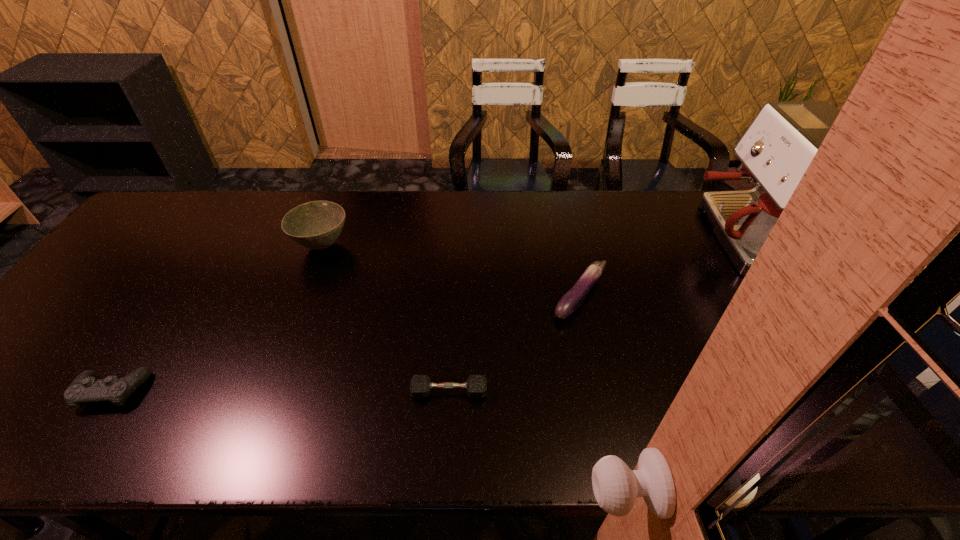
At what (x,y) coordinates should I click in order to perform the action: click on vacant area that lies between the third object from right to left and the second object from right to left. Please return your answer as a coordinate pair (x, y). Image resolution: width=960 pixels, height=540 pixels. Looking at the image, I should click on (515, 345).

The height and width of the screenshot is (540, 960). Find the location of `free space between the tallest object and the shortest object`. free space between the tallest object and the shortest object is located at coordinates (598, 314).

Where is `empty space that is in between the tallest object and the bowl`? The height and width of the screenshot is (540, 960). empty space that is in between the tallest object and the bowl is located at coordinates (535, 241).

This screenshot has width=960, height=540. What are the coordinates of `vacant point located between the leftmost object and the third object from right to left` in the screenshot? It's located at (280, 392).

Find the location of a particular element. Image resolution: width=960 pixels, height=540 pixels. vacant point located between the eggplant and the bowl is located at coordinates (451, 271).

Find the location of a particular element. This screenshot has height=540, width=960. vacant area that lies between the shortest object and the eggplant is located at coordinates (515, 345).

You are a GUI agent. You are given a task and a screenshot of the screen. Output one action in this format:
    pyautogui.click(x=<x>, y=<y>)
    Task: Click on the object identified as the fourth closest to the third object from right to left
    
    Given the screenshot: What is the action you would take?
    pyautogui.click(x=778, y=146)

Identify which object is the fourth nearest to the control. Please provide its 2D coordinates. Your answer should be formatted as a tuple, i.e. [(x, y)], where the tuple contains the x and y coordinates of a point satisfying the conditions above.

[(778, 146)]